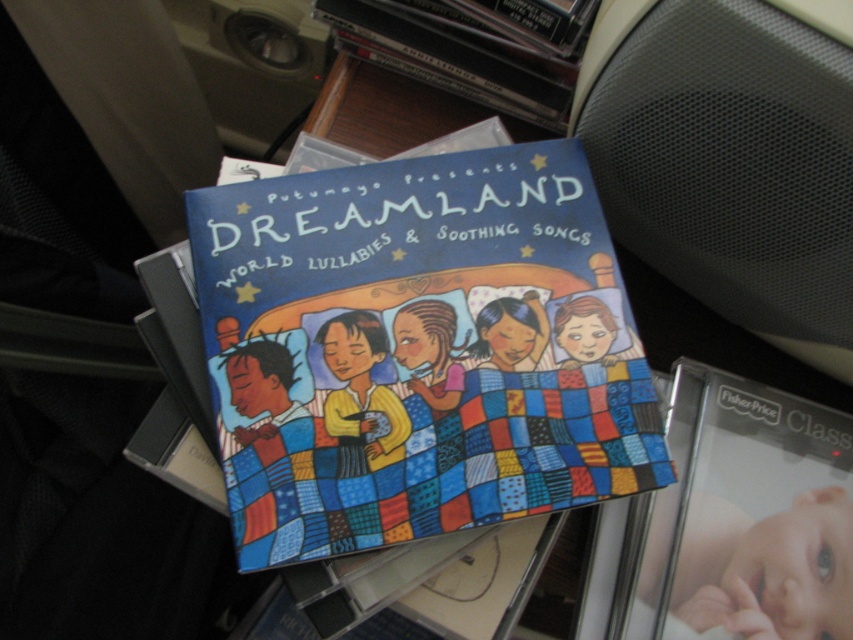
Question: Does smooth skin baby at lower right have a greater width compared to matte black book at upper center?

Choices:
 (A) yes
 (B) no

Answer: (B)

Question: Which point is closer to the camera taking this photo?

Choices:
 (A) (619, 372)
 (B) (390, 56)
 (C) (695, 493)

Answer: (A)

Question: Does matte blue quilted book at center lie behind matte black book at upper center?

Choices:
 (A) yes
 (B) no

Answer: (B)

Question: Which object is positioned farthest from the smooth skin baby at lower right?

Choices:
 (A) matte black book at upper center
 (B) matte blue quilted book at center

Answer: (A)

Question: Estimate the real-world distances between objects in this image. Which object is closer to the matte black book at upper center?

Choices:
 (A) matte blue quilted book at center
 (B) smooth skin baby at lower right

Answer: (A)

Question: Is matte blue quilted book at center thinner than smooth skin baby at lower right?

Choices:
 (A) yes
 (B) no

Answer: (B)